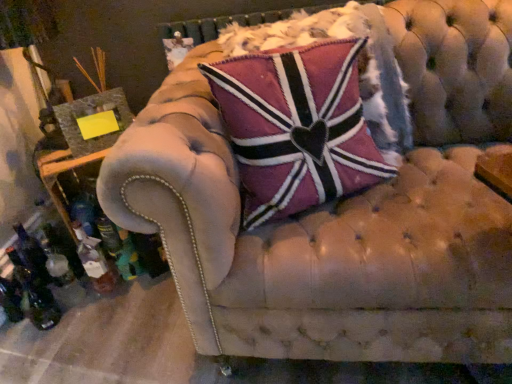
I want to click on translucent glass bottle at lower left, so click(x=95, y=263).

The height and width of the screenshot is (384, 512). What do you see at coordinates (95, 263) in the screenshot?
I see `translucent glass bottle at lower left` at bounding box center [95, 263].

In order to face pink velvet pillow at center, should I rotate leftwards or rightwards?

To face it directly, rotate right by 8.299 degrees.

What are the coordinates of `pink velvet pillow at center` in the screenshot? It's located at click(x=297, y=127).

The width and height of the screenshot is (512, 384). Describe the element at coordinates (297, 127) in the screenshot. I see `pink velvet pillow at center` at that location.

What is the approximate width of pink velvet pillow at center?

pink velvet pillow at center is 10.45 inches wide.

Locate an element on the screen. This screenshot has width=512, height=384. translucent glass bottle at lower left is located at coordinates (95, 263).

Does pink velvet pillow at center appear on the right side of translucent glass bottle at lower left?

Correct, you'll find pink velvet pillow at center to the right of translucent glass bottle at lower left.

Is pink velvet pillow at center closer to the viewer compared to translucent glass bottle at lower left?

Yes, the depth of pink velvet pillow at center is less than that of translucent glass bottle at lower left.

Is point (266, 201) closer or farther from the camera than point (83, 248)?

Point (266, 201).

From the image's perspective, who appears lower, pink velvet pillow at center or translucent glass bottle at lower left?

translucent glass bottle at lower left, from the image's perspective.

From a real-world perspective, which is physically below, pink velvet pillow at center or translucent glass bottle at lower left?

In real-world perspective, translucent glass bottle at lower left is lower.

Which object is wider, pink velvet pillow at center or translucent glass bottle at lower left?

Wider between the two is pink velvet pillow at center.

Considering the sizes of objects pink velvet pillow at center and translucent glass bottle at lower left in the image provided, who is shorter, pink velvet pillow at center or translucent glass bottle at lower left?

translucent glass bottle at lower left is shorter.

Between pink velvet pillow at center and translucent glass bottle at lower left, which one has smaller size?

translucent glass bottle at lower left.

Would you say pink velvet pillow at center contains translucent glass bottle at lower left?

No, pink velvet pillow at center does not contain translucent glass bottle at lower left.

Are pink velvet pillow at center and translucent glass bottle at lower left located far from each other?

No, pink velvet pillow at center is not far away from translucent glass bottle at lower left.

Does pink velvet pillow at center turn towards translucent glass bottle at lower left?

No.

This screenshot has height=384, width=512. In order to click on pillow lying above the translucent glass bottle at lower left (from the image's perspective) in this screenshot , I will do (x=297, y=127).

Which object is positioned more to the left, translucent glass bottle at lower left or pink velvet pillow at center?

Positioned to the left is translucent glass bottle at lower left.

Which object is closer to the camera taking this photo, translucent glass bottle at lower left or pink velvet pillow at center?

pink velvet pillow at center is more forward.

Considering the positions of points (112, 286) and (269, 132), is point (112, 286) farther from camera compared to point (269, 132)?

Yes, it is.

From the image's perspective, would you say translucent glass bottle at lower left is shown under pink velvet pillow at center?

Yes.

From a real-world perspective, between translucent glass bottle at lower left and pink velvet pillow at center, who is vertically higher?

pink velvet pillow at center.

In terms of width, does translucent glass bottle at lower left look wider or thinner when compared to pink velvet pillow at center?

Clearly, translucent glass bottle at lower left has less width compared to pink velvet pillow at center.

Who is shorter, translucent glass bottle at lower left or pink velvet pillow at center?

translucent glass bottle at lower left.

Is translucent glass bottle at lower left bigger than pink velvet pillow at center?

Actually, translucent glass bottle at lower left might be smaller than pink velvet pillow at center.

Is pink velvet pillow at center completely or partially inside translucent glass bottle at lower left?

No, pink velvet pillow at center is not inside translucent glass bottle at lower left.

Is translucent glass bottle at lower left positioned far away from pink velvet pillow at center?

translucent glass bottle at lower left is actually quite close to pink velvet pillow at center.

Is translucent glass bottle at lower left looking in the opposite direction of pink velvet pillow at center?

No.

What's the angular difference between translucent glass bottle at lower left and pink velvet pillow at center's facing directions?

16.1 degrees separate the facing orientations of translucent glass bottle at lower left and pink velvet pillow at center.

Image resolution: width=512 pixels, height=384 pixels. I want to click on bottle that appears behind the pink velvet pillow at center, so click(95, 263).

Where is `bottle located behind the pink velvet pillow at center`? This screenshot has width=512, height=384. bottle located behind the pink velvet pillow at center is located at coordinates (95, 263).

Where is `pillow in front of the translucent glass bottle at lower left`? The image size is (512, 384). pillow in front of the translucent glass bottle at lower left is located at coordinates [x=297, y=127].